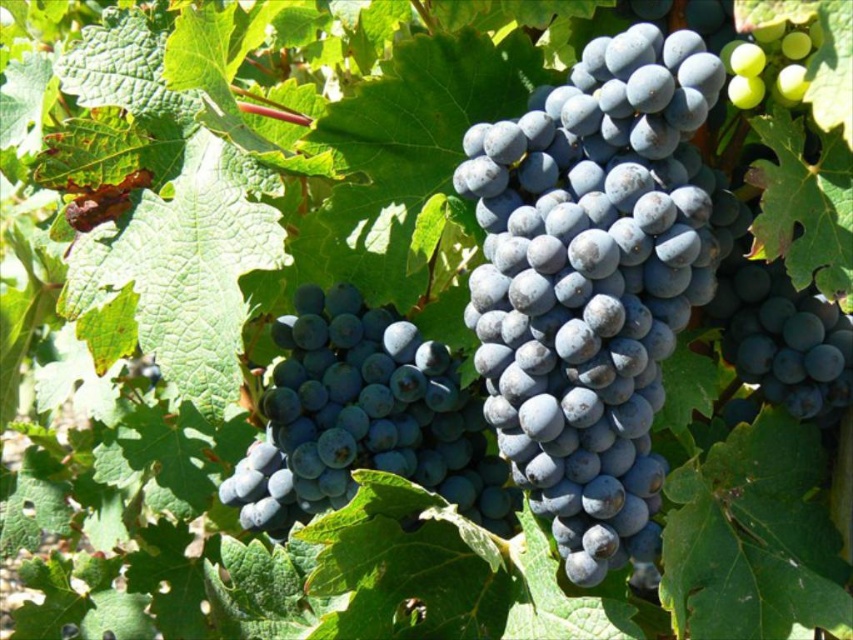
Question: Is blue matte grape at center smaller than green matte grape at upper right?

Choices:
 (A) yes
 (B) no

Answer: (B)

Question: Can you confirm if shiny dark blue grapes at center is bigger than green matte grape at upper right?

Choices:
 (A) no
 (B) yes

Answer: (B)

Question: Among these points, which one is farthest from the camera?

Choices:
 (A) (251, 493)
 (B) (698, 196)

Answer: (A)

Question: Which object appears farthest from the camera in this image?

Choices:
 (A) shiny dark blue grapes at center
 (B) matte dark blue grapes at center
 (C) blue matte grape at center

Answer: (A)

Question: Which of the following is the closest to the observer?

Choices:
 (A) shiny dark blue grapes at center
 (B) blue matte grape at center

Answer: (B)

Question: Does blue matte grape at center appear on the left side of green matte grape at upper right?

Choices:
 (A) no
 (B) yes

Answer: (A)